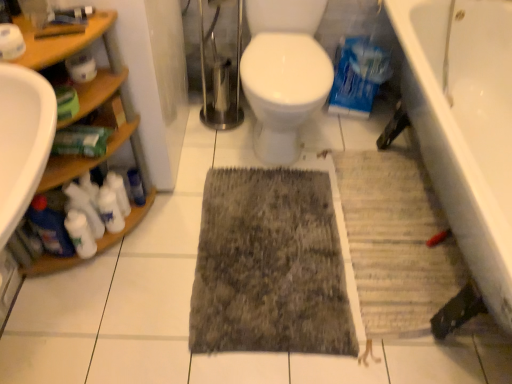
This screenshot has width=512, height=384. Identify the location of vacant area located to the right-hand side of white matte cleaning product at lower left, the 3th cleaning product viewed from the right. (136, 261).